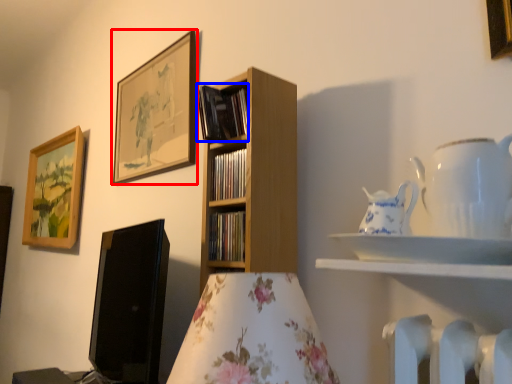
Question: Which point is closer to the camera, picture frame (highlighted by a red box) or book (highlighted by a blue box)?

Choices:
 (A) picture frame
 (B) book

Answer: (B)